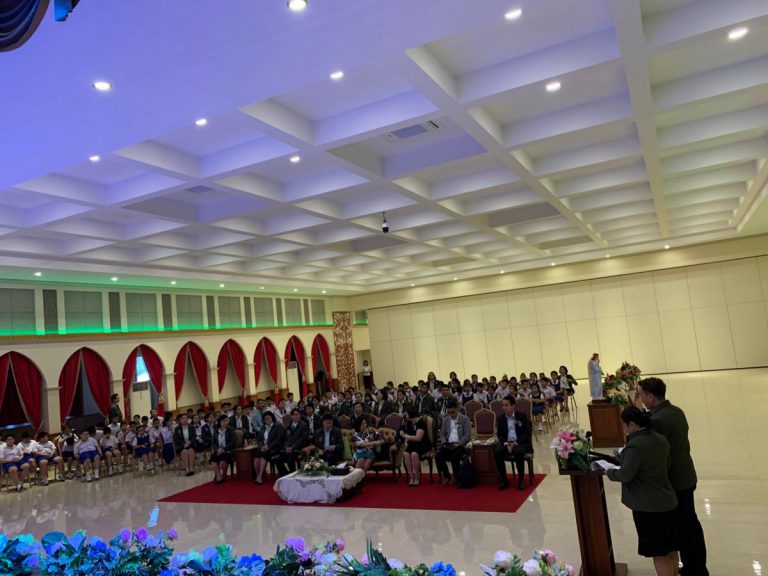
At what (x,y) coordinates should I click in order to perform the action: click on square ceiling beams. Please return your answer as a coordinate pair (x, y). Looking at the image, I should click on (389, 179), (498, 156), (641, 113).